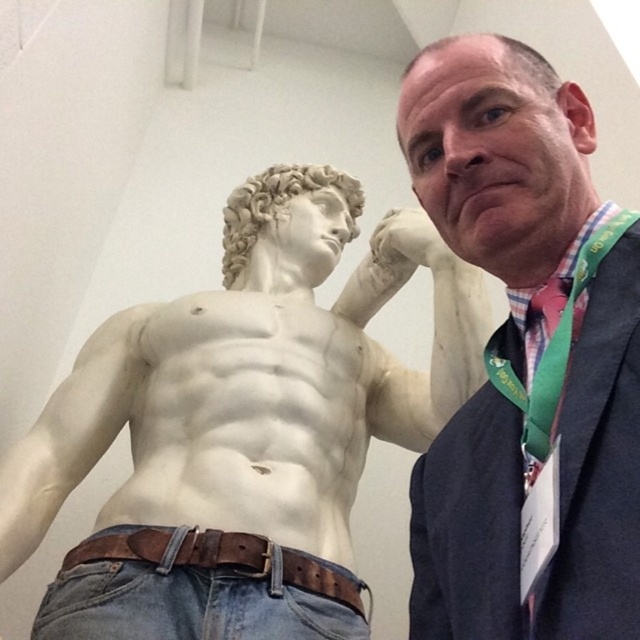
Question: Which of the following is the farthest from the observer?

Choices:
 (A) brown leather belt at lower center
 (B) matte white statue at upper left

Answer: (A)

Question: Is white marble statue at center positioned in front of brown leather belt at lower center?

Choices:
 (A) no
 (B) yes

Answer: (B)

Question: Which of the following is the closest to the observer?

Choices:
 (A) white marble statue at center
 (B) brown leather belt at lower center

Answer: (A)

Question: Does matte white statue at upper left appear under brown leather belt at lower center?

Choices:
 (A) yes
 (B) no

Answer: (B)

Question: Is white marble statue at center closer to camera compared to matte white statue at upper left?

Choices:
 (A) yes
 (B) no

Answer: (B)

Question: Which object is the closest to the matte white statue at upper left?

Choices:
 (A) matte pink fabric tie at right
 (B) white marble statue at center

Answer: (A)